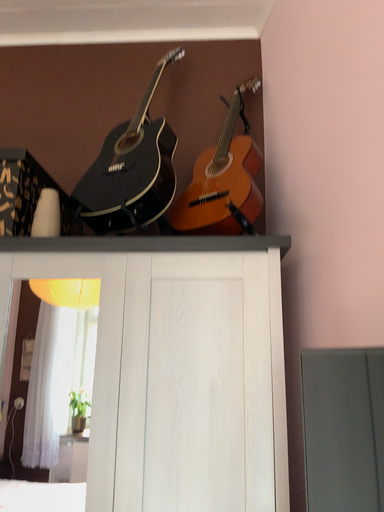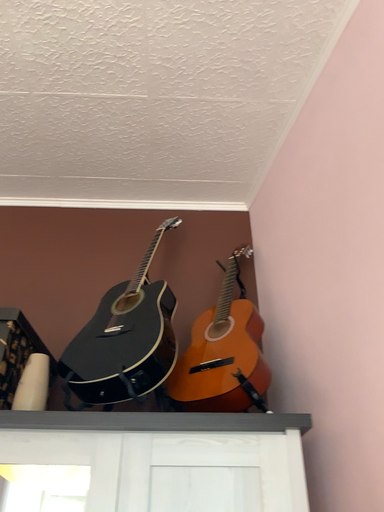
Question: Which way did the camera rotate in the video?

Choices:
 (A) rotated upward
 (B) rotated downward

Answer: (A)